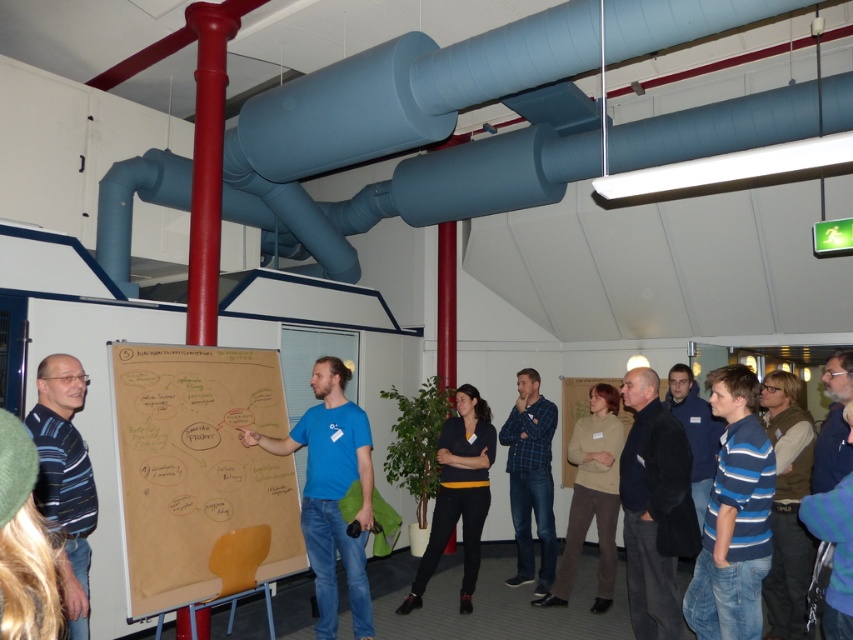
Can you confirm if striped cotton shirt at left is positioned to the right of blue striped shirt at center?

Incorrect, striped cotton shirt at left is not on the right side of blue striped shirt at center.

Based on the photo, who is higher up, striped cotton shirt at left or blue striped shirt at center?

striped cotton shirt at left is above.

Which is in front, point (83, 618) or point (698, 420)?

Point (83, 618) is in front.

At what (x,y) coordinates should I click in order to perform the action: click on striped cotton shirt at left. Please return your answer as a coordinate pair (x, y). The image size is (853, 640). Looking at the image, I should click on (65, 480).

Between beige sweater at center and blue plaid shirt at center, which one has more height?

blue plaid shirt at center is taller.

Can you confirm if beige sweater at center is thinner than blue plaid shirt at center?

In fact, beige sweater at center might be wider than blue plaid shirt at center.

Describe the element at coordinates (590, 497) in the screenshot. I see `beige sweater at center` at that location.

I want to click on beige sweater at center, so click(x=590, y=497).

Which is in front, point (288, 451) or point (517, 532)?

Point (288, 451)

Between blue matte shirt at center and blue plaid shirt at center, which one is positioned higher?

Positioned higher is blue matte shirt at center.

Is point (331, 508) closer to viewer compared to point (554, 532)?

Yes, point (331, 508) is in front of point (554, 532).

This screenshot has width=853, height=640. In order to click on blue matte shirt at center in this screenshot , I will do `click(331, 492)`.